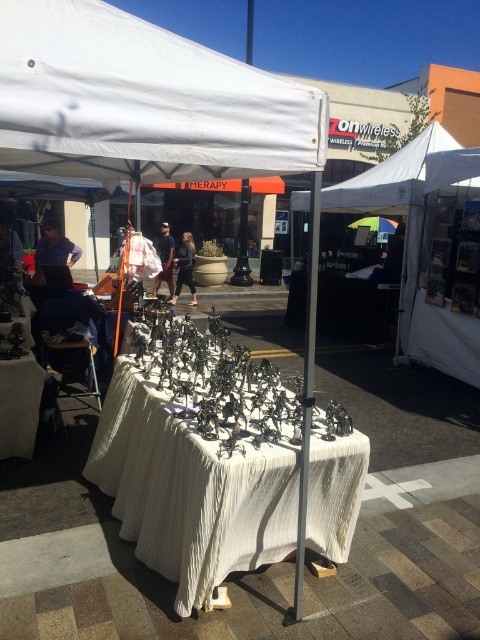
Which is more to the right, matte blue shirt at left or dark gray pants at center?

From the viewer's perspective, dark gray pants at center appears more on the right side.

Looking at this image, can you confirm if matte blue shirt at left is smaller than dark gray pants at center?

Yes.

The height and width of the screenshot is (640, 480). What do you see at coordinates (52, 250) in the screenshot? I see `matte blue shirt at left` at bounding box center [52, 250].

At what (x,y) coordinates should I click in order to perform the action: click on matte blue shirt at left. Please return your answer as a coordinate pair (x, y). Image resolution: width=480 pixels, height=640 pixels. Looking at the image, I should click on (52, 250).

Which of these two, metallic silver figurines at center or white fabric tent at upper center, stands shorter?

white fabric tent at upper center is shorter.

Does metallic silver figurines at center come in front of white fabric tent at upper center?

Yes.

The image size is (480, 640). Describe the element at coordinates (220, 465) in the screenshot. I see `metallic silver figurines at center` at that location.

Identify the location of metallic silver figurines at center. (220, 465).

Who is positioned more to the right, white fabric tent at upper center or dark gray pants at center?

white fabric tent at upper center is more to the right.

Which is behind, point (412, 257) or point (190, 250)?

Positioned behind is point (190, 250).

Describe the element at coordinates (394, 193) in the screenshot. I see `white fabric tent at upper center` at that location.

Identify the location of white fabric tent at upper center. (394, 193).